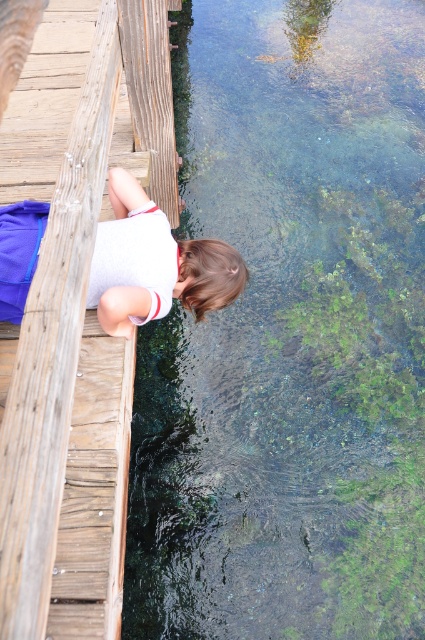
You are a photographer trying to capture a shot of the wooden dock at left and the white matte shirt at upper left. Based on their heights, which object should you focus on first to ensure both are in frame?

The wooden dock at left is taller than the white matte shirt at upper left, so you should focus on the wooden dock at left first to ensure both are in frame.

Consider the image. You are standing on the wooden dock at left and want to see the bottom of the clear water at lower left. Which direction should you look to see the bottom?

You should look downward because the clear water at lower left is positioned under the wooden dock at left, so looking down from the dock will allow you to see the bottom.

You are a photographer trying to capture the scene from above. You notice the clear water at lower left and the white matte shirt at upper left. Which object occupies a wider area in the image?

The clear water at lower left occupies a wider area in the image because its width is larger than that of the white matte shirt at upper left.